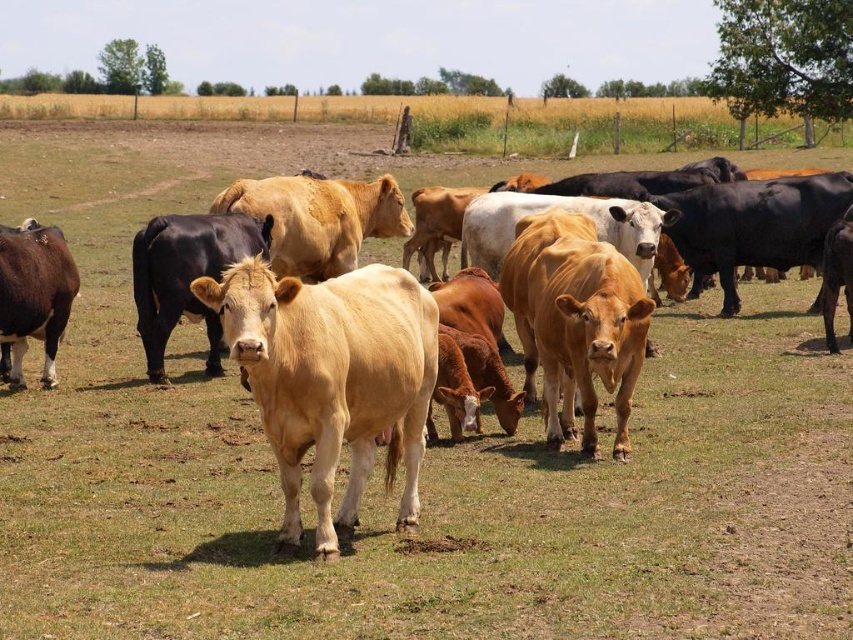
Question: Which of the following is the closest to the observer?

Choices:
 (A) shiny black bull at center
 (B) brown glossy cow at left

Answer: (B)

Question: Can you confirm if shiny black bull at center is thinner than brown glossy cow at left?

Choices:
 (A) no
 (B) yes

Answer: (A)

Question: Where is shiny black bull at center located in relation to brown glossy cow at left in the image?

Choices:
 (A) above
 (B) below

Answer: (A)

Question: Can you confirm if shiny black bull at center is positioned to the left of brown glossy cow at left?

Choices:
 (A) yes
 (B) no

Answer: (B)